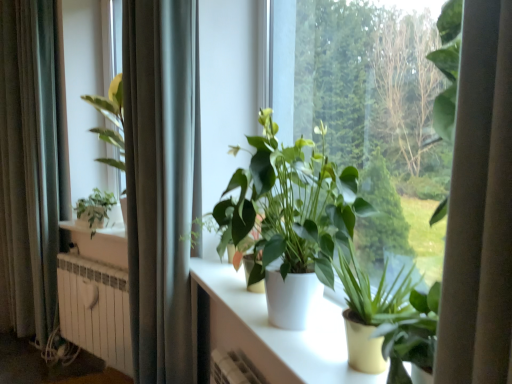
Question: From a real-world perspective, does silky gray curtain at left, arranged as the first curtain when viewed from the back, sit lower than green matte plant at center, the third houseplant when ordered from back to front?

Choices:
 (A) no
 (B) yes

Answer: (A)

Question: Considering the relative sizes of silky gray curtain at left, which ranks as the 1th curtain in left-to-right order, and green matte plant at center, the first houseplant in the front-to-back sequence, in the image provided, is silky gray curtain at left, which ranks as the 1th curtain in left-to-right order, shorter than green matte plant at center, the first houseplant in the front-to-back sequence,?

Choices:
 (A) no
 (B) yes

Answer: (A)

Question: From the image's perspective, would you say silky gray curtain at left, which is counted as the 2th curtain, starting from the front, is positioned over green matte plant at center, which is the 3th houseplant from left to right?

Choices:
 (A) yes
 (B) no

Answer: (A)

Question: From the image's perspective, is silky gray curtain at left, the second curtain in the right-to-left sequence, below green matte plant at center, the third houseplant when ordered from back to front?

Choices:
 (A) no
 (B) yes

Answer: (A)

Question: Is silky gray curtain at left, which ranks as the 1th curtain in left-to-right order, looking in the opposite direction of green matte plant at center, which is the 3th houseplant from left to right?

Choices:
 (A) yes
 (B) no

Answer: (B)

Question: Is white metallic radiator at lower left inside or outside of green matte plant at center, which is the 3th houseplant from left to right?

Choices:
 (A) inside
 (B) outside

Answer: (B)

Question: Does point (126, 312) appear closer or farther from the camera than point (407, 332)?

Choices:
 (A) closer
 (B) farther

Answer: (B)

Question: Is white metallic radiator at lower left taller or shorter than green matte plant at center, which is the 3th houseplant from left to right?

Choices:
 (A) short
 (B) tall

Answer: (B)

Question: Considering the positions of white metallic radiator at lower left and green matte plant at center, the third houseplant when ordered from back to front, in the image, is white metallic radiator at lower left wider or thinner than green matte plant at center, the third houseplant when ordered from back to front,?

Choices:
 (A) thin
 (B) wide

Answer: (A)

Question: From the image's perspective, is gray fabric curtain at left, which ranks as the first curtain in right-to-left order, above or below green matte plant at left, acting as the 1th houseplant starting from the back?

Choices:
 (A) below
 (B) above

Answer: (B)

Question: In terms of height, does gray fabric curtain at left, the second curtain in the left-to-right sequence, look taller or shorter compared to green matte plant at left, which is the first houseplant from left to right?

Choices:
 (A) short
 (B) tall

Answer: (B)

Question: Is gray fabric curtain at left, the first curtain when ordered from front to back, inside the boundaries of green matte plant at left, marked as the third houseplant in a right-to-left arrangement, or outside?

Choices:
 (A) inside
 (B) outside

Answer: (B)

Question: Considering the positions of gray fabric curtain at left, which ranks as the first curtain in right-to-left order, and green matte plant at left, which is the first houseplant from left to right, in the image, is gray fabric curtain at left, which ranks as the first curtain in right-to-left order, bigger or smaller than green matte plant at left, which is the first houseplant from left to right,?

Choices:
 (A) big
 (B) small

Answer: (A)

Question: Is silky gray curtain at left, the second curtain in the right-to-left sequence, taller or shorter than white glossy table at center?

Choices:
 (A) tall
 (B) short

Answer: (A)

Question: Looking at the image, does silky gray curtain at left, the second curtain in the right-to-left sequence, seem bigger or smaller compared to white glossy table at center?

Choices:
 (A) big
 (B) small

Answer: (A)